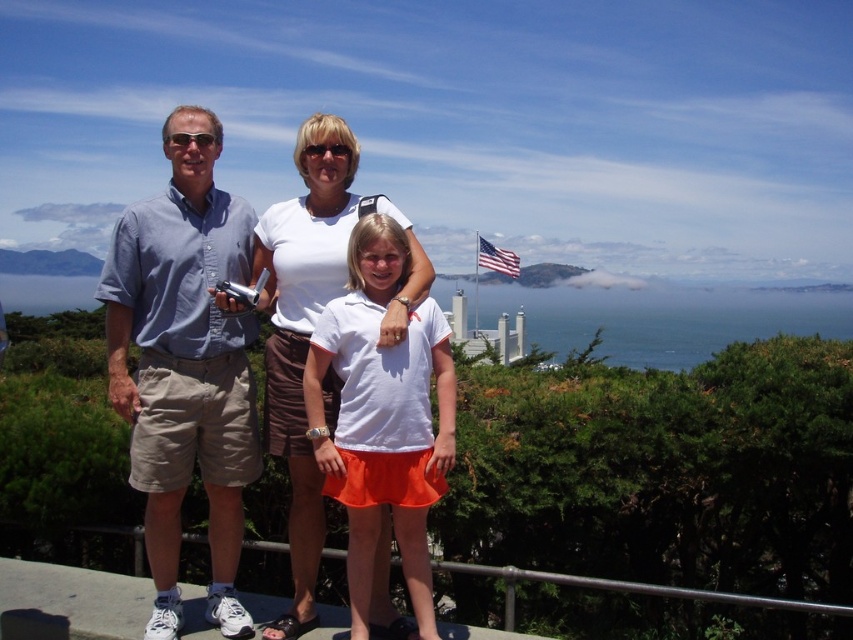
Is the position of light blue shirt at center less distant than that of white cotton shirt at center?

Yes, light blue shirt at center is in front of white cotton shirt at center.

Which is more to the right, light blue shirt at center or white cotton shirt at center?

white cotton shirt at center is more to the right.

Who is more distant from viewer, (x=126, y=259) or (x=297, y=241)?

Point (x=297, y=241)

Locate an element on the screen. This screenshot has height=640, width=853. light blue shirt at center is located at coordinates (184, 364).

Who is lower down, light blue shirt at center or white matte shirt at center?

white matte shirt at center is below.

Is light blue shirt at center to the right of white matte shirt at center from the viewer's perspective?

In fact, light blue shirt at center is to the left of white matte shirt at center.

Does point (175, 508) come in front of point (427, 570)?

No.

The height and width of the screenshot is (640, 853). I want to click on light blue shirt at center, so [184, 364].

Between white matte shirt at center and american flag at center, which one has more height?

Standing taller between the two is american flag at center.

In order to click on white matte shirt at center in this screenshot , I will do `click(381, 419)`.